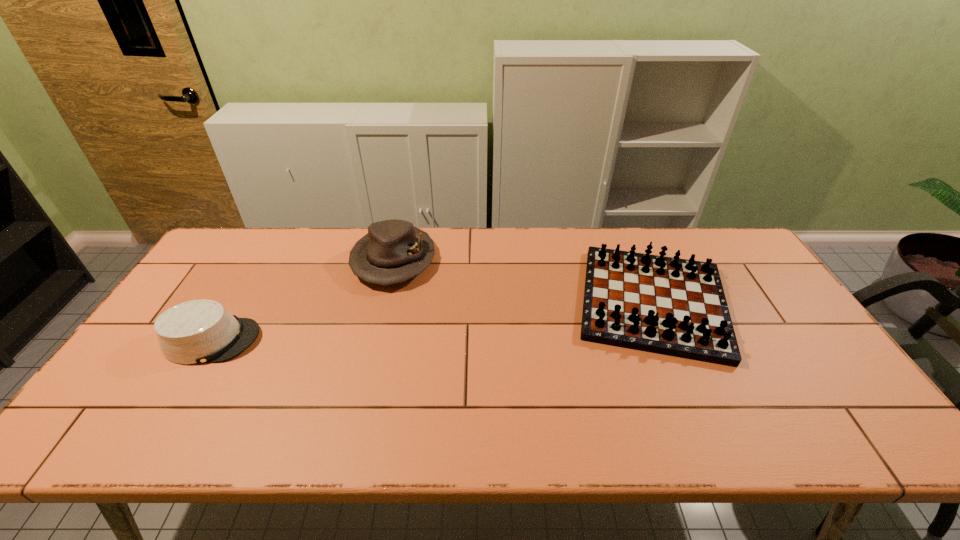
What are the coordinates of `object present at the left edge` in the screenshot? It's located at (200, 331).

Find the location of a particular element. object present at the right edge is located at coordinates (677, 307).

Find the location of `object positioned at the far right corner`. object positioned at the far right corner is located at coordinates (677, 307).

Identify the location of free space at the far edge of the desktop. (323, 258).

Find the location of a particular element. This screenshot has height=540, width=960. vacant space at the near edge of the desktop is located at coordinates (489, 436).

Identify the location of vacant region at the right edge of the desktop. This screenshot has width=960, height=540. (753, 323).

The image size is (960, 540). In order to click on blank space at the far left corner of the desktop in this screenshot , I will do 252,245.

The width and height of the screenshot is (960, 540). Identify the location of free space at the near left corner. (105, 435).

Image resolution: width=960 pixels, height=540 pixels. What are the coordinates of `free space at the far right corner` in the screenshot? It's located at (729, 264).

This screenshot has height=540, width=960. Identify the location of empty space that is in between the rightmost object and the taller hat. (523, 281).